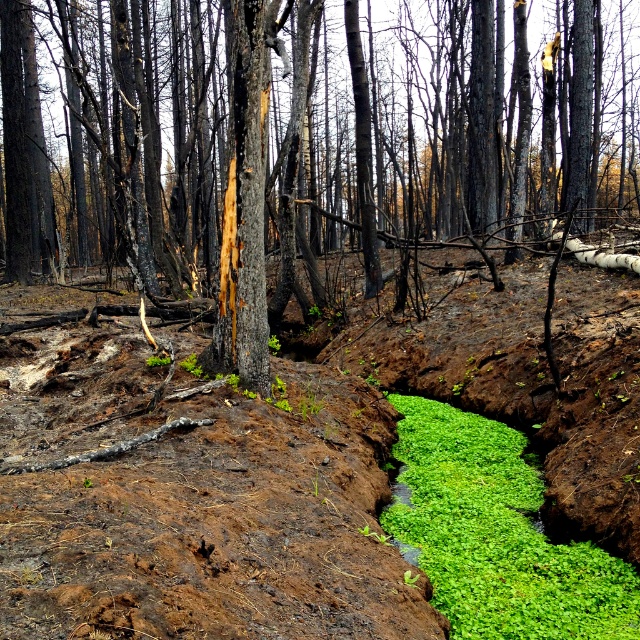
Between point (602, 291) and point (515, 540), which one is positioned behind?

Positioned behind is point (602, 291).

Which is behind, point (204, 570) or point (438, 600)?

The point (438, 600) is more distant.

Find the location of a particular element. Image resolution: width=640 pixels, height=640 pixels. green mossy soil at center is located at coordinates tap(296, 465).

Does charred bark tree at center have a lesser width compared to green mossy soil at center?

In fact, charred bark tree at center might be wider than green mossy soil at center.

Identify the location of charred bark tree at center. (301, 150).

Between charred bark tree at center and green leafy algae at center, which one has more height?

charred bark tree at center is taller.

Can you confirm if charred bark tree at center is wider than green leafy algae at center?

Yes.

What do you see at coordinates (301, 150) in the screenshot? This screenshot has width=640, height=640. I see `charred bark tree at center` at bounding box center [301, 150].

What are the coordinates of `charred bark tree at center` in the screenshot? It's located at (301, 150).